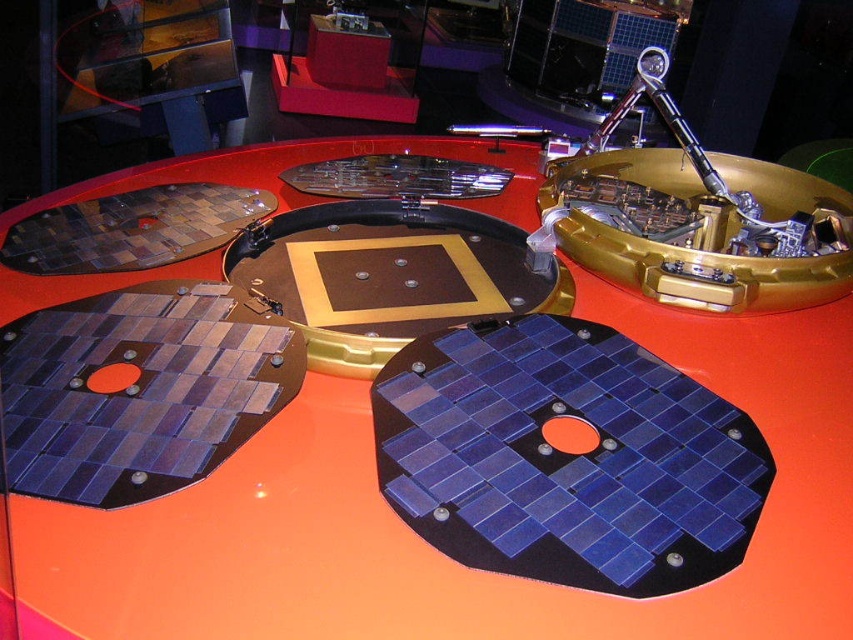
Question: Is blue glossy solar panel at center closer to the viewer compared to gold metallic robotic arm at upper center?

Choices:
 (A) yes
 (B) no

Answer: (A)

Question: Is blue glossy solar panel at center to the left of gold metallic robotic arm at upper center from the viewer's perspective?

Choices:
 (A) yes
 (B) no

Answer: (A)

Question: Does blue glossy solar panel at center appear over gold metallic robotic arm at upper center?

Choices:
 (A) no
 (B) yes

Answer: (A)